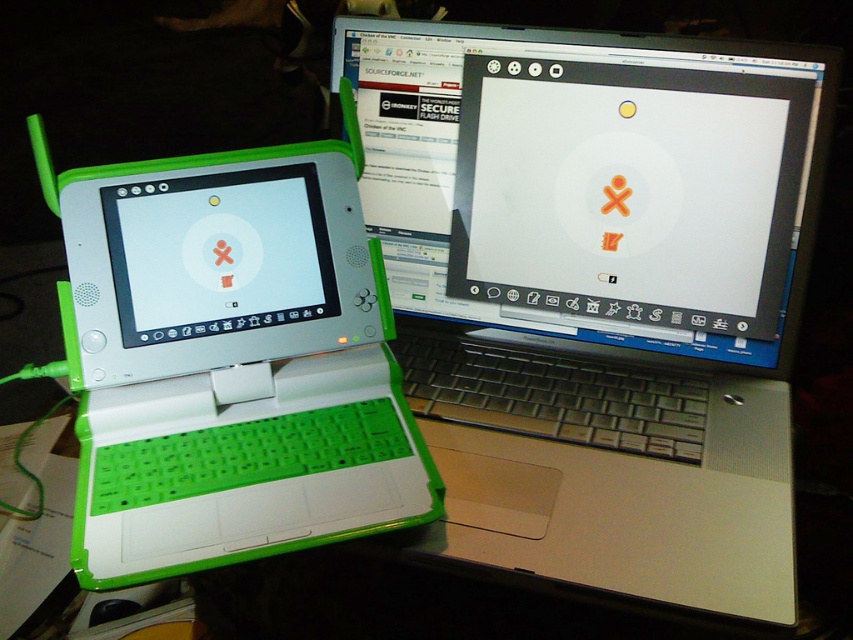
You are standing in front of the two laptops and want to place a sticker on the point that is closer to you. Which point should you choose between point (x=192, y=237) and point (x=138, y=276)?

Point (x=138, y=276) is closer to you because it is in front of point (x=192, y=237).

You are a delivery person who needs to place a new laptop on the desk. The desk has limited space between the green plastic laptop at center and the green matte laptop at left. Can you fit the new laptop there?

The green matte laptop at left is behind the green plastic laptop at center, so there is no space between them to place the new laptop.